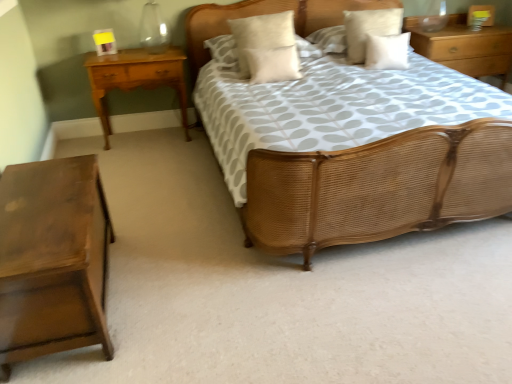
Question: Is white soft pillow at upper center, the 5th pillow positioned from the right, surrounding white cotton pillow at upper center, arranged as the second pillow when viewed from the right?

Choices:
 (A) no
 (B) yes

Answer: (A)

Question: Is white soft pillow at upper center, positioned as the 1th pillow in left-to-right order, placed right next to white cotton pillow at upper center, arranged as the second pillow when viewed from the right?

Choices:
 (A) yes
 (B) no

Answer: (B)

Question: Considering the relative sizes of white soft pillow at upper center, the 5th pillow positioned from the right, and white cotton pillow at upper center, acting as the fourth pillow starting from the left, in the image provided, is white soft pillow at upper center, the 5th pillow positioned from the right, bigger than white cotton pillow at upper center, acting as the fourth pillow starting from the left,?

Choices:
 (A) yes
 (B) no

Answer: (A)

Question: From the image's perspective, is white soft pillow at upper center, positioned as the 1th pillow in left-to-right order, located beneath white cotton pillow at upper center, acting as the fourth pillow starting from the left?

Choices:
 (A) yes
 (B) no

Answer: (A)

Question: Is white soft pillow at upper center, positioned as the 1th pillow in left-to-right order, positioned far away from white cotton pillow at upper center, acting as the fourth pillow starting from the left?

Choices:
 (A) no
 (B) yes

Answer: (B)

Question: From the image's perspective, is white soft pillow at upper center, the 5th pillow positioned from the right, on top of white cotton pillow at upper center, acting as the fourth pillow starting from the left?

Choices:
 (A) no
 (B) yes

Answer: (A)

Question: Is white soft pillow at center, which is the third pillow from left to right, to the right of white cotton pillow at upper center, arranged as the second pillow when viewed from the right, from the viewer's perspective?

Choices:
 (A) yes
 (B) no

Answer: (B)

Question: Is white soft pillow at center, which is the third pillow from left to right, positioned far away from white cotton pillow at upper center, arranged as the second pillow when viewed from the right?

Choices:
 (A) no
 (B) yes

Answer: (A)

Question: From a real-world perspective, is white soft pillow at center, which is the third pillow from left to right, on white cotton pillow at upper center, arranged as the second pillow when viewed from the right?

Choices:
 (A) yes
 (B) no

Answer: (B)

Question: Can you confirm if white soft pillow at center, which is the third pillow from left to right, is positioned to the left of white cotton pillow at upper center, acting as the fourth pillow starting from the left?

Choices:
 (A) yes
 (B) no

Answer: (A)

Question: From the image's perspective, is white soft pillow at center, the 3th pillow from the right, located beneath white cotton pillow at upper center, arranged as the second pillow when viewed from the right?

Choices:
 (A) no
 (B) yes

Answer: (B)

Question: Does white soft pillow at center, the 3th pillow from the right, have a smaller size compared to white cotton pillow at upper center, acting as the fourth pillow starting from the left?

Choices:
 (A) no
 (B) yes

Answer: (B)

Question: Is white soft cushion at center, which appears as the 2th pillow when viewed from the left, oriented away from wooden nightstand at upper right, the 3th nightstand from the front?

Choices:
 (A) no
 (B) yes

Answer: (A)